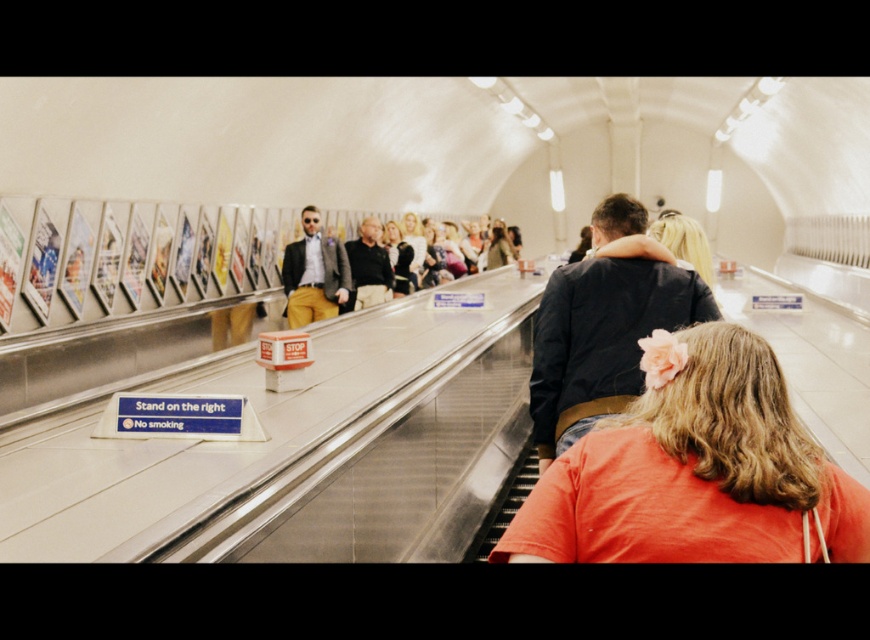
You are a passenger on the escalator in the subway station. You notice two people ahead of you on the right side of the escalator. One is wearing a dark blue jacket at center, and the other has blonde hair at upper center. Which of these two people is positioned more to the left from your perspective?

The dark blue jacket at center is positioned more to the left than the blonde hair at upper center from your perspective.

You are standing at the bottom of the escalator in the subway station. You notice two points marked on the escalator. The first point is at coordinate point(587, 404) and the second point is at coordinate point(407, 260). Which point is closer to you?

Point(587, 404) is closer to you because it is closer to the camera than point(407, 260).